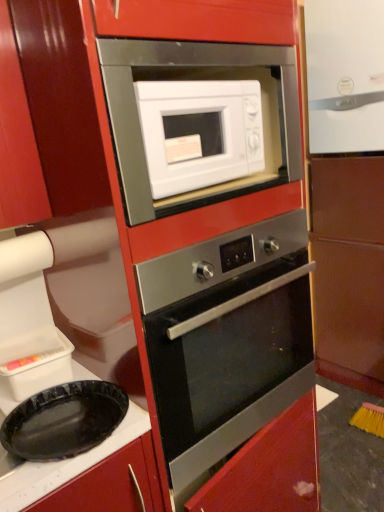
Question: Does black plastic plate at lower left have a greater width compared to stainless steel oven at center?

Choices:
 (A) yes
 (B) no

Answer: (B)

Question: From a real-world perspective, is black plastic plate at lower left located higher than stainless steel oven at center?

Choices:
 (A) no
 (B) yes

Answer: (A)

Question: Is black plastic plate at lower left touching stainless steel oven at center?

Choices:
 (A) yes
 (B) no

Answer: (B)

Question: Is stainless steel oven at center inside black plastic plate at lower left?

Choices:
 (A) no
 (B) yes

Answer: (A)

Question: Is black plastic plate at lower left closer to the viewer compared to stainless steel oven at center?

Choices:
 (A) no
 (B) yes

Answer: (B)

Question: Considering the positions of black plastic plate at lower left and white glossy microwave at center in the image, is black plastic plate at lower left wider or thinner than white glossy microwave at center?

Choices:
 (A) thin
 (B) wide

Answer: (B)

Question: Considering the positions of black plastic plate at lower left and white glossy microwave at center in the image, is black plastic plate at lower left bigger or smaller than white glossy microwave at center?

Choices:
 (A) big
 (B) small

Answer: (B)

Question: In terms of height, does black plastic plate at lower left look taller or shorter compared to white glossy microwave at center?

Choices:
 (A) tall
 (B) short

Answer: (B)

Question: Considering their positions, is black plastic plate at lower left located in front of or behind white glossy microwave at center?

Choices:
 (A) front
 (B) behind

Answer: (A)

Question: Is point (226, 92) positioned closer to the camera than point (311, 1)?

Choices:
 (A) closer
 (B) farther

Answer: (A)

Question: From a real-world perspective, relative to white glossy refrigerator at upper right, is white glossy microwave at center vertically above or below?

Choices:
 (A) above
 (B) below

Answer: (B)

Question: Considering the positions of white glossy microwave at center and white glossy refrigerator at upper right in the image, is white glossy microwave at center bigger or smaller than white glossy refrigerator at upper right?

Choices:
 (A) big
 (B) small

Answer: (B)

Question: Would you say white glossy microwave at center is to the left or to the right of white glossy refrigerator at upper right in the picture?

Choices:
 (A) left
 (B) right

Answer: (A)

Question: From a real-world perspective, is stainless steel oven at center positioned above or below matte brown cabinet at right?

Choices:
 (A) below
 (B) above

Answer: (A)

Question: Is stainless steel oven at center taller or shorter than matte brown cabinet at right?

Choices:
 (A) short
 (B) tall

Answer: (A)